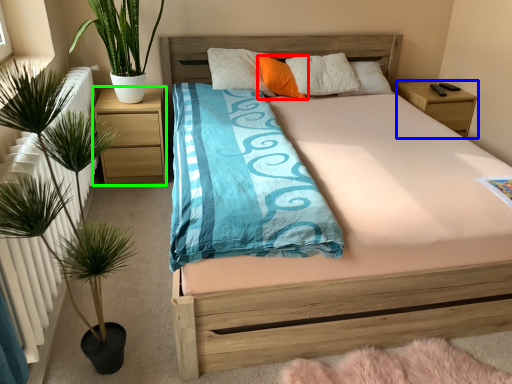
Question: Based on their relative distances, which object is farther from pillow (highlighted by a red box)? Choose from nightstand (highlighted by a blue box) and nightstand (highlighted by a green box).

Choices:
 (A) nightstand
 (B) nightstand

Answer: (A)